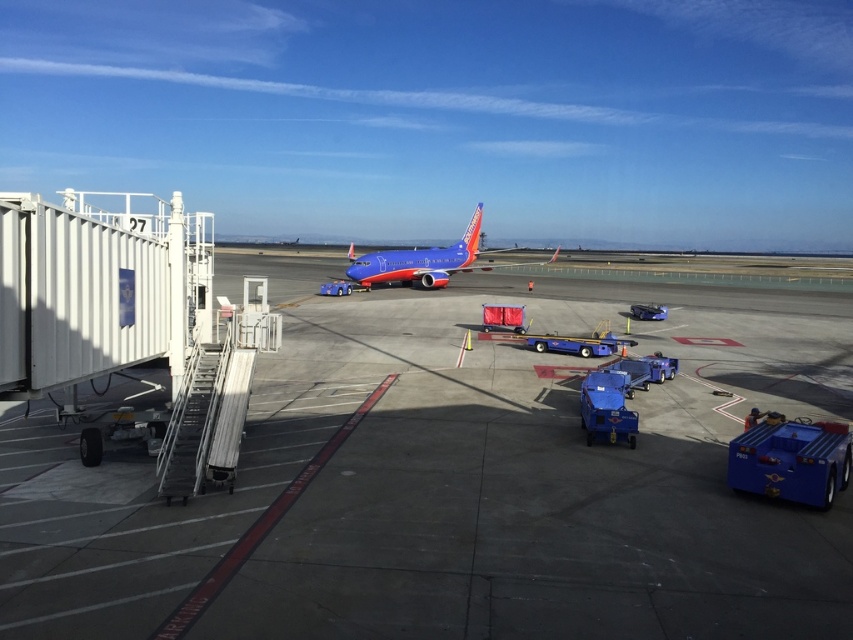
Can you confirm if smooth concrete tarmac at center is bigger than blue painted airplane at center?

Actually, smooth concrete tarmac at center might be smaller than blue painted airplane at center.

Is point (566, 445) closer to camera compared to point (402, 269)?

That is True.

At what (x,y) coordinates should I click in order to perform the action: click on smooth concrete tarmac at center. Please return your answer as a coordinate pair (x, y). The image size is (853, 640). Looking at the image, I should click on (453, 483).